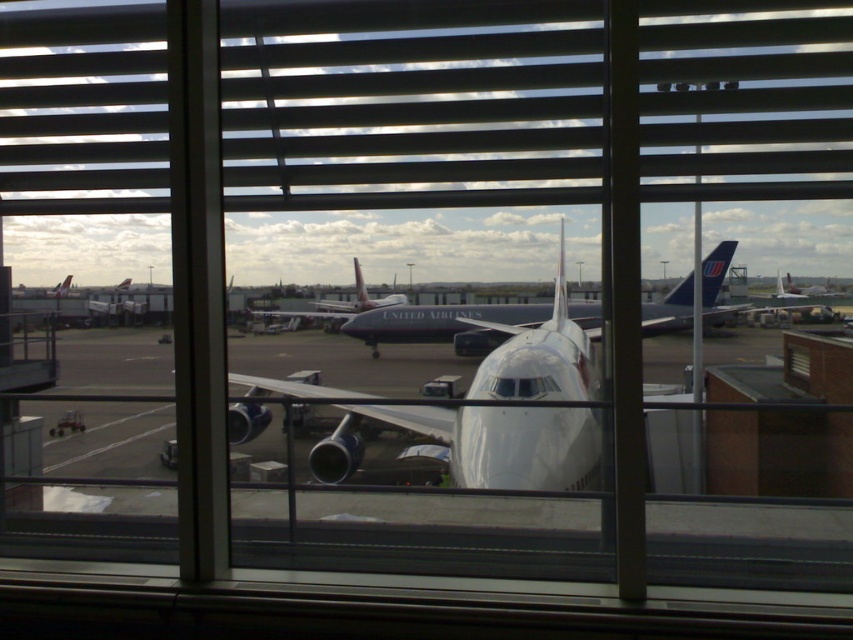
Question: Is smooth plastic blinds at center to the left of matte white airplane at center from the viewer's perspective?

Choices:
 (A) yes
 (B) no

Answer: (B)

Question: Which of the following is the closest to the observer?

Choices:
 (A) white matte airplane at center
 (B) matte white airplane at center
 (C) white glossy airplane at center
 (D) smooth plastic blinds at center

Answer: (D)

Question: Does smooth plastic blinds at center appear over white glossy airplane at center?

Choices:
 (A) yes
 (B) no

Answer: (A)

Question: Which of the following is the farthest from the observer?

Choices:
 (A) (479, 161)
 (B) (405, 312)

Answer: (B)

Question: Which of the following is the farthest from the observer?

Choices:
 (A) (770, 225)
 (B) (453, 442)

Answer: (A)

Question: Is smooth plastic blinds at center to the left of white matte airplane at center from the viewer's perspective?

Choices:
 (A) yes
 (B) no

Answer: (A)